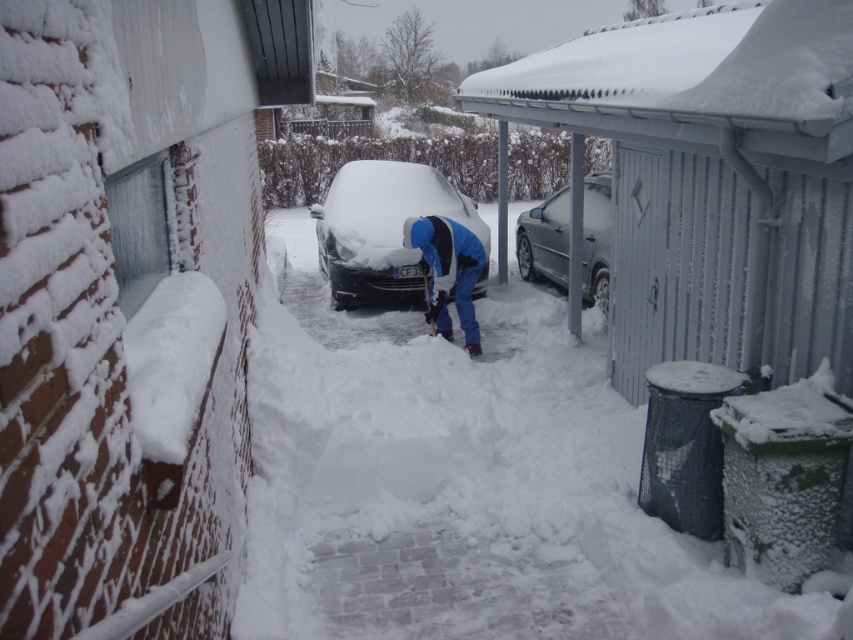
Who is shorter, white fluffy snow at center or blue fabric jacket at center?

Standing shorter between the two is white fluffy snow at center.

Is point (689, 589) farther from camera compared to point (469, 320)?

No.

Between point (405, 426) and point (434, 262), which one is positioned in front?

Point (405, 426) is in front.

At what (x,y) coordinates should I click in order to perform the action: click on white fluffy snow at center. Please return your answer as a coordinate pair (x, y). Looking at the image, I should click on (466, 484).

Between metallic gray sedan at center and blue fabric jacket at center, which one appears on the right side from the viewer's perspective?

metallic gray sedan at center is more to the right.

Identify the location of metallic gray sedan at center. (544, 241).

Is shiny black car at center closer to the viewer compared to blue fabric jacket at center?

No, shiny black car at center is further to the viewer.

Between shiny black car at center and blue fabric jacket at center, which one appears on the right side from the viewer's perspective?

From the viewer's perspective, blue fabric jacket at center appears more on the right side.

Image resolution: width=853 pixels, height=640 pixels. I want to click on shiny black car at center, so click(x=384, y=228).

Identify the location of shiny black car at center. (384, 228).